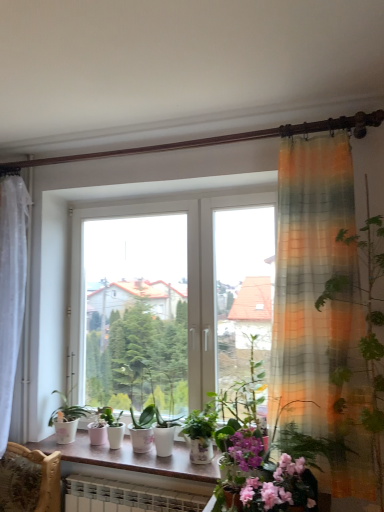
Question: Should I look upward or downward to see pink matte flower at lower center?

Choices:
 (A) down
 (B) up

Answer: (A)

Question: Can you confirm if green matte plant at center is shorter than white glossy window sill at center?

Choices:
 (A) no
 (B) yes

Answer: (A)

Question: From a real-world perspective, does green matte plant at center stand above white glossy window sill at center?

Choices:
 (A) yes
 (B) no

Answer: (A)

Question: Can you confirm if green matte plant at center is bigger than white glossy window sill at center?

Choices:
 (A) yes
 (B) no

Answer: (B)

Question: Can you confirm if green matte plant at center is positioned to the left of white glossy window sill at center?

Choices:
 (A) no
 (B) yes

Answer: (B)

Question: Does green matte plant at center have a lesser width compared to white glossy window sill at center?

Choices:
 (A) yes
 (B) no

Answer: (A)

Question: Is green matte plant at center located outside white glossy window sill at center?

Choices:
 (A) no
 (B) yes

Answer: (B)

Question: Is white glossy window sill at center to the right of pink matte flower at lower center from the viewer's perspective?

Choices:
 (A) yes
 (B) no

Answer: (B)

Question: Is pink matte flower at lower center at the back of white glossy window sill at center?

Choices:
 (A) no
 (B) yes

Answer: (A)

Question: Does white glossy window sill at center have a larger size compared to pink matte flower at lower center?

Choices:
 (A) yes
 (B) no

Answer: (A)

Question: Could you tell me if white glossy window sill at center is turned towards pink matte flower at lower center?

Choices:
 (A) no
 (B) yes

Answer: (A)

Question: Does white glossy window sill at center have a lesser width compared to pink matte flower at lower center?

Choices:
 (A) yes
 (B) no

Answer: (B)

Question: Would you say white glossy window sill at center contains pink matte flower at lower center?

Choices:
 (A) no
 (B) yes

Answer: (A)

Question: Does white glossy window sill at center appear on the left side of green matte plant at center?

Choices:
 (A) no
 (B) yes

Answer: (A)